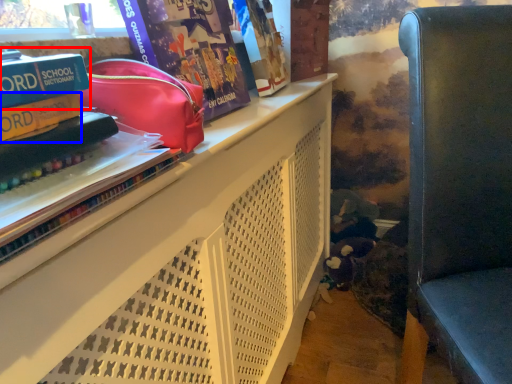
Question: Among these objects, which one is nearest to the camera, paperback book (highlighted by a red box) or paperback book (highlighted by a blue box)?

Choices:
 (A) paperback book
 (B) paperback book

Answer: (A)